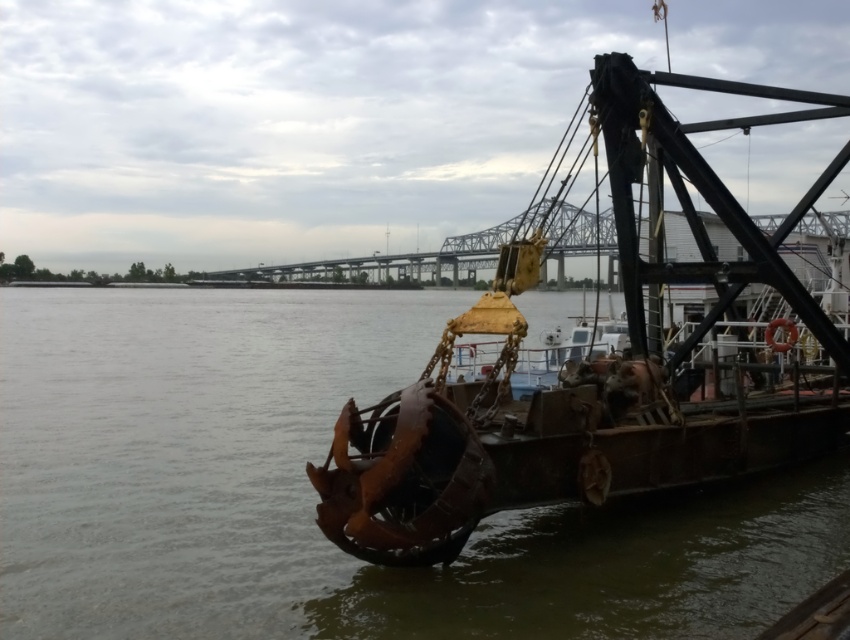
Can you confirm if rusty metal river at center is bigger than rusty metal barge at center?

Incorrect, rusty metal river at center is not larger than rusty metal barge at center.

Is rusty metal river at center smaller than rusty metal barge at center?

Yes, rusty metal river at center is smaller than rusty metal barge at center.

Who is more distant from viewer, (476, 577) or (593, 116)?

Point (593, 116)

I want to click on rusty metal river at center, so click(x=315, y=493).